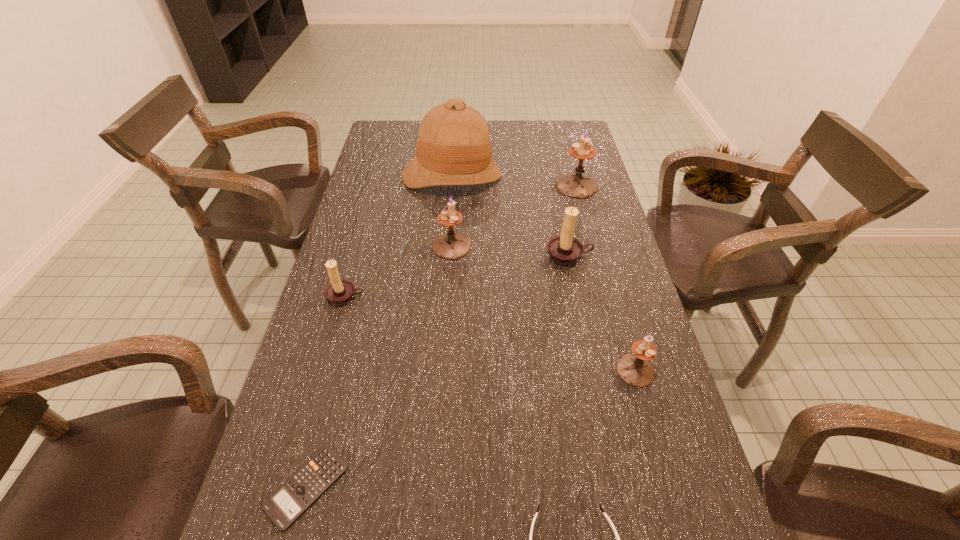
This screenshot has height=540, width=960. Find the location of `the tallest object`. the tallest object is located at coordinates (453, 148).

The image size is (960, 540). Identify the location of the farthest purple candle holder. (575, 185).

Locate an element on the screen. Image resolution: width=960 pixels, height=540 pixels. the tallest candle holder is located at coordinates (575, 185).

You are a GUI agent. You are given a task and a screenshot of the screen. Output one action in this format:
    pyautogui.click(x=<x>, y=<y>)
    Task: Click on the second candle holder from left to right
    The height and width of the screenshot is (540, 960).
    Given the screenshot: What is the action you would take?
    pyautogui.click(x=451, y=245)

Where is `the second biggest purple candle holder`? The width and height of the screenshot is (960, 540). the second biggest purple candle holder is located at coordinates (451, 245).

The width and height of the screenshot is (960, 540). I want to click on the farther brown candle holder, so click(564, 249).

Where is `the right brown candle holder`? Image resolution: width=960 pixels, height=540 pixels. the right brown candle holder is located at coordinates (564, 249).

Locate an element on the screen. The image size is (960, 540). the nearest purple candle holder is located at coordinates (635, 369).

In order to click on the smallest purple candle holder in this screenshot , I will do `click(635, 369)`.

Image resolution: width=960 pixels, height=540 pixels. I want to click on the fifth farthest object, so click(x=340, y=291).